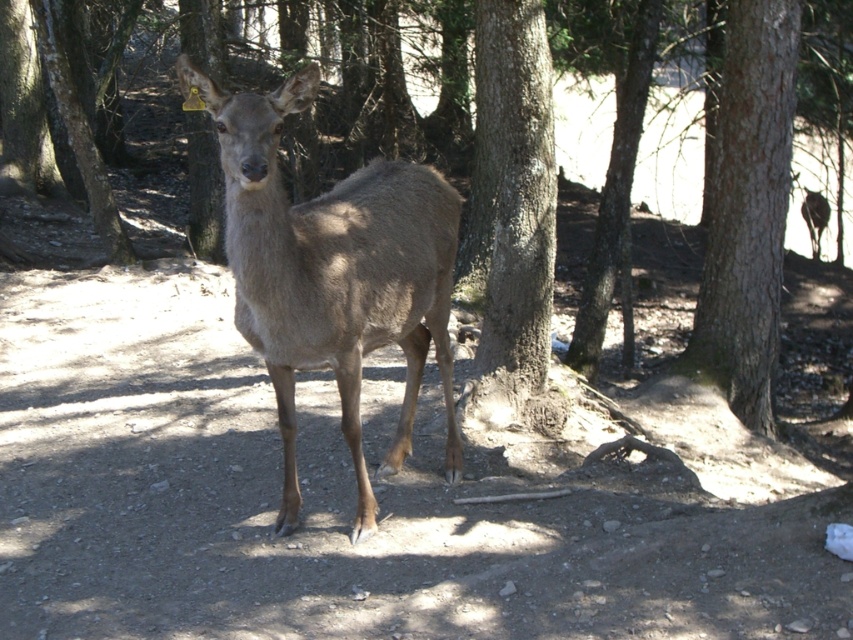
Is brown fur deer at center wider than brown rough tree at center?

Indeed, brown fur deer at center has a greater width compared to brown rough tree at center.

Is point (363, 524) behind point (706, 253)?

No, it is not.

I want to click on brown fur deer at center, so click(x=334, y=273).

Can you confirm if smooth bark tree at center is positioned above brown rough tree at center?

Actually, smooth bark tree at center is below brown rough tree at center.

Which is above, smooth bark tree at center or brown rough tree at center?

brown rough tree at center

Is point (526, 49) in front of point (709, 284)?

Yes, it is.

Where is `smooth bark tree at center`? The width and height of the screenshot is (853, 640). smooth bark tree at center is located at coordinates (512, 212).

Between brown fur deer at center and smooth bark tree at center, which one appears on the right side from the viewer's perspective?

smooth bark tree at center

Can you confirm if brown fur deer at center is positioned below smooth bark tree at center?

Indeed, brown fur deer at center is positioned under smooth bark tree at center.

Find the location of a particular element. This screenshot has height=640, width=853. brown fur deer at center is located at coordinates (334, 273).

Find the location of a particular element. brown fur deer at center is located at coordinates (334, 273).